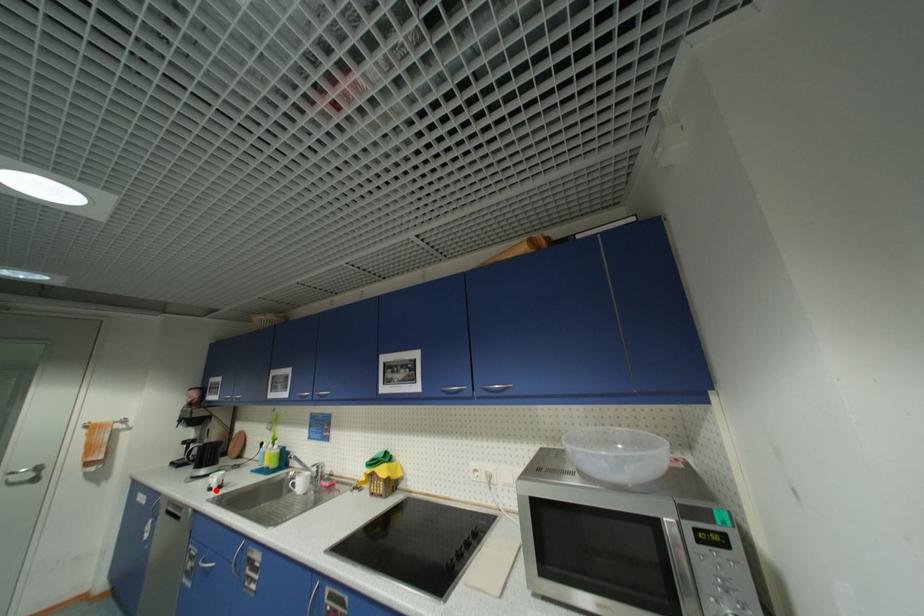
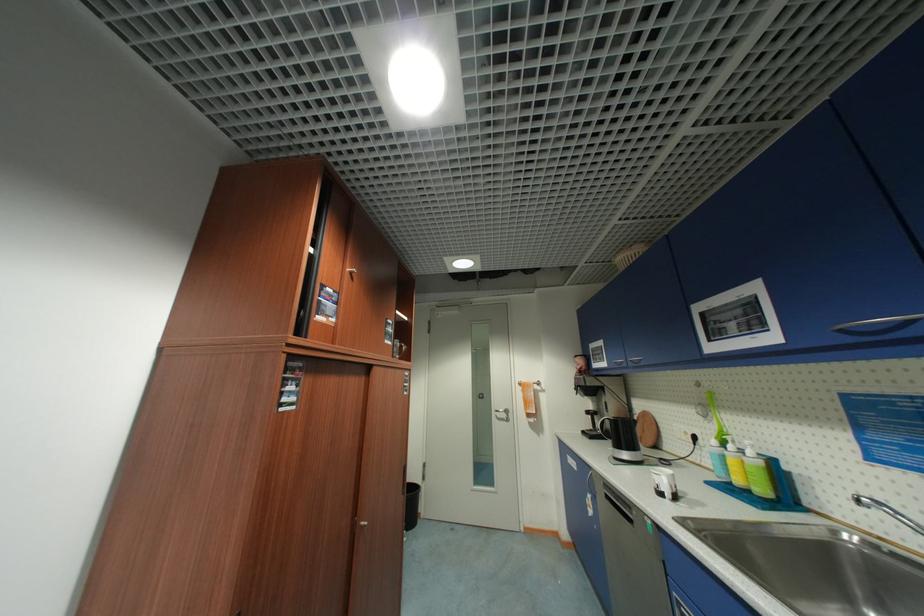
In the second image, find the point that corresponds to the highlighted location in the first image.

(666, 495)